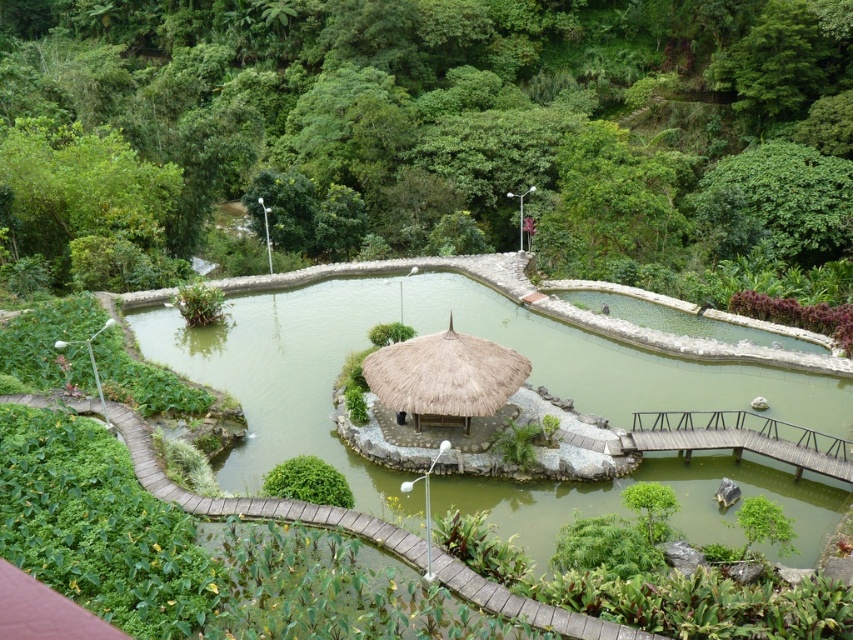
You are a landscape architect designing a new garden. You want to place a statue that is 1.2 meters tall between the green water at center and the wooden bridge at lower right. Based on their heights, will the statue be taller than both objects?

The green water at center has a greater height compared to wooden bridge at lower right. Since the statue is 1.2 meters tall, we need to compare it with both objects. However, the exact heights of the green water and wooden bridge are not provided. Therefore, it is impossible to determine if the statue will be taller than both objects without additional information.